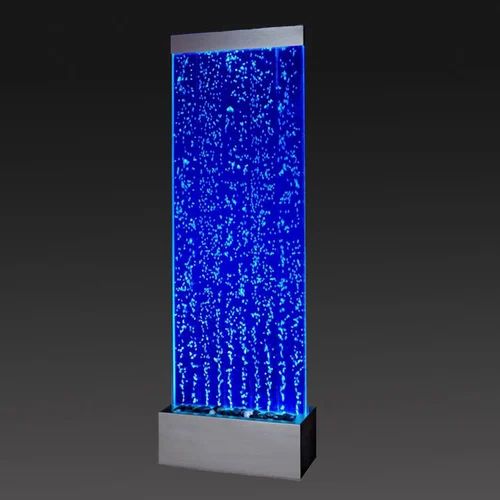
Locate an element on the screen. top light is located at coordinates (232, 48).